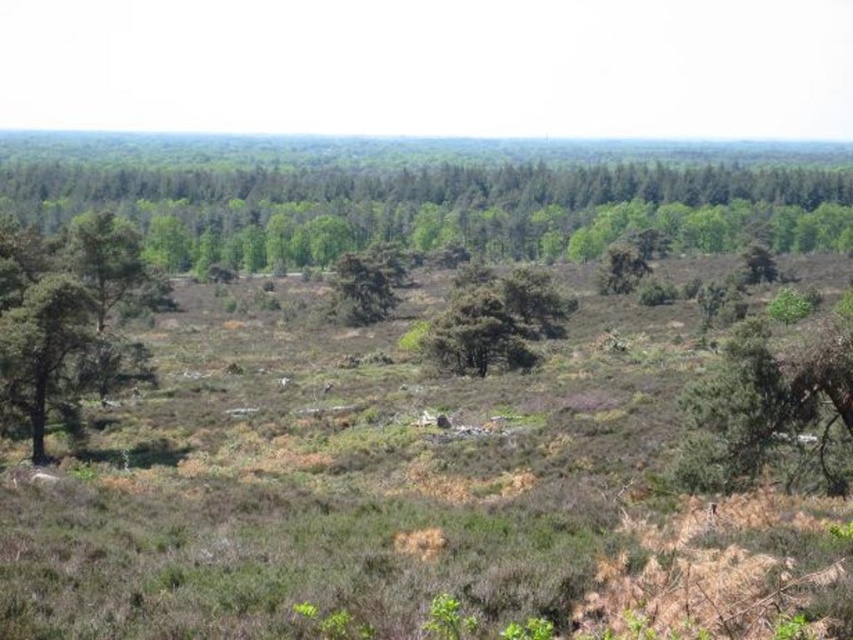
Question: Does green rough bark tree at left appear on the right side of green leafy tree at right?

Choices:
 (A) no
 (B) yes

Answer: (A)

Question: Which of the following is the closest to the observer?

Choices:
 (A) green leafy trees at upper center
 (B) green leafy tree at center

Answer: (B)

Question: Based on their relative distances, which object is nearer to the green leafy tree at right?

Choices:
 (A) green rough bark tree at left
 (B) green leafy tree at center
 (C) green matte tree at center

Answer: (A)

Question: Which object is closer to the camera taking this photo?

Choices:
 (A) green leafy tree at center
 (B) green leafy tree at center-right
 (C) green matte tree at center
 (D) green leafy trees at upper center

Answer: (A)

Question: Observing the image, what is the correct spatial positioning of green rough bark tree at left in reference to green leafy tree at right?

Choices:
 (A) left
 (B) right

Answer: (A)

Question: Considering the relative positions of green leafy tree at center and green leafy tree at center-right in the image provided, where is green leafy tree at center located with respect to green leafy tree at center-right?

Choices:
 (A) left
 (B) right

Answer: (A)